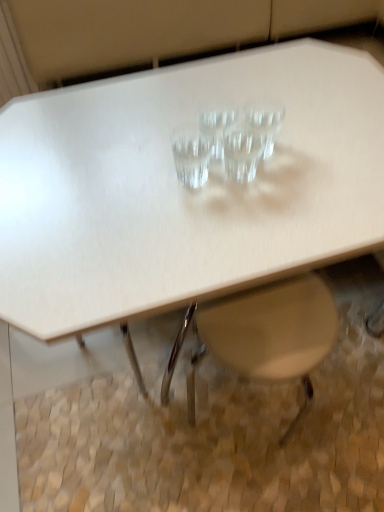
Question: Relative to transparent glass martini glass at center, acting as the 4th martini glass starting from the left, is white plastic swivel chair at lower center in front or behind?

Choices:
 (A) behind
 (B) front

Answer: (B)

Question: From the image's perspective, is white plastic swivel chair at lower center located above or below transparent glass martini glass at center, acting as the 4th martini glass starting from the left?

Choices:
 (A) above
 (B) below

Answer: (B)

Question: Estimate the real-world distances between objects in this image. Which object is farther from the white plastic swivel chair at lower center?

Choices:
 (A) transparent glass martini glass at center, which is the second martini glass from left to right
 (B) transparent glass martini glass at center, acting as the 4th martini glass starting from the left
 (C) transparent glass martini glass at center, marked as the fourth martini glass in a right-to-left arrangement
 (D) transparent glass martini at center, which is the 2th martini glass from right to left

Answer: (A)

Question: Which of these objects is positioned closest to the transparent glass martini at center, which is the 3th martini glass in left-to-right order?

Choices:
 (A) transparent glass martini glass at center, placed as the third martini glass when sorted from right to left
 (B) transparent glass martini glass at center, acting as the 4th martini glass starting from the left
 (C) transparent glass martini glass at center, marked as the fourth martini glass in a right-to-left arrangement
 (D) white plastic swivel chair at lower center

Answer: (A)